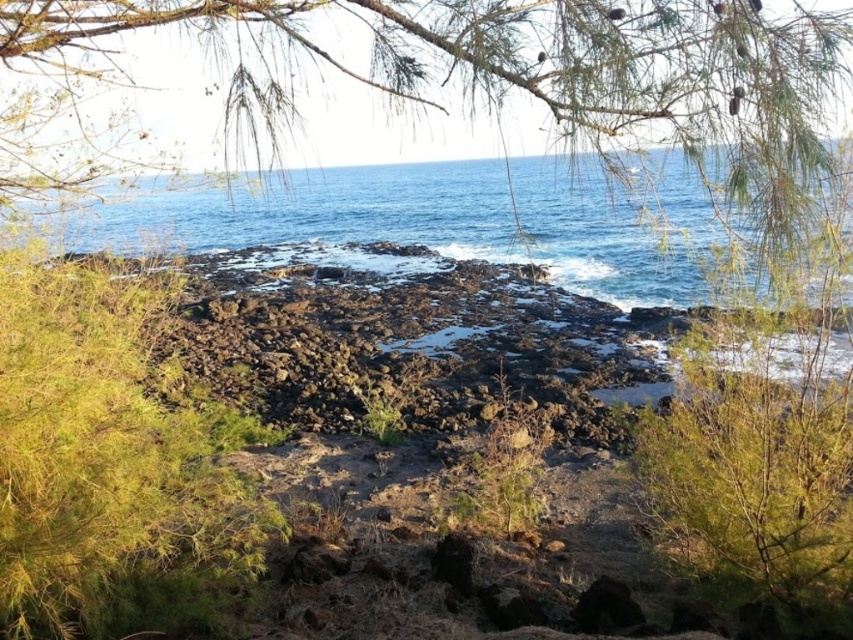
Question: Which object appears farthest from the camera in this image?

Choices:
 (A) green leafy tree at upper right
 (B) blue water at center

Answer: (B)

Question: Where is blue water at center located in relation to green leafy tree at upper right in the image?

Choices:
 (A) right
 (B) left

Answer: (B)

Question: Is blue water at center positioned behind green leafy tree at upper right?

Choices:
 (A) no
 (B) yes

Answer: (B)

Question: Which of the following is the closest to the observer?

Choices:
 (A) (822, 298)
 (B) (700, 260)

Answer: (A)

Question: Among these points, which one is nearest to the camera?

Choices:
 (A) (167, 205)
 (B) (780, 403)

Answer: (B)

Question: Considering the relative positions of blue water at center and green leafy tree at upper right in the image provided, where is blue water at center located with respect to green leafy tree at upper right?

Choices:
 (A) above
 (B) below

Answer: (A)